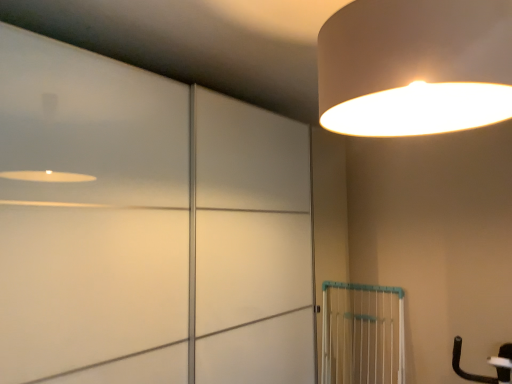
Question: Could you tell me if white plastic gate at lower right is turned towards matte white lampshade at upper right?

Choices:
 (A) no
 (B) yes

Answer: (A)

Question: Does white plastic gate at lower right have a larger size compared to matte white lampshade at upper right?

Choices:
 (A) yes
 (B) no

Answer: (B)

Question: Can you confirm if white plastic gate at lower right is smaller than matte white lampshade at upper right?

Choices:
 (A) no
 (B) yes

Answer: (B)

Question: Are white plastic gate at lower right and matte white lampshade at upper right making contact?

Choices:
 (A) yes
 (B) no

Answer: (B)

Question: Does white plastic gate at lower right appear on the right side of matte white lampshade at upper right?

Choices:
 (A) no
 (B) yes

Answer: (B)

Question: Is point pyautogui.click(x=457, y=110) positioned closer to the camera than point pyautogui.click(x=343, y=291)?

Choices:
 (A) farther
 (B) closer

Answer: (B)

Question: Is matte white lampshade at upper right inside the boundaries of white plastic gate at lower right, or outside?

Choices:
 (A) inside
 (B) outside

Answer: (B)

Question: Looking at the image, does matte white lampshade at upper right seem bigger or smaller compared to white plastic gate at lower right?

Choices:
 (A) big
 (B) small

Answer: (A)

Question: Relative to white plastic gate at lower right, is matte white lampshade at upper right in front or behind?

Choices:
 (A) behind
 (B) front

Answer: (B)

Question: Considering the positions of white matte sliding door at upper left and matte white lampshade at upper right in the image, is white matte sliding door at upper left wider or thinner than matte white lampshade at upper right?

Choices:
 (A) thin
 (B) wide

Answer: (A)

Question: Which is correct: white matte sliding door at upper left is inside matte white lampshade at upper right, or outside of it?

Choices:
 (A) inside
 (B) outside

Answer: (B)

Question: In terms of size, does white matte sliding door at upper left appear bigger or smaller than matte white lampshade at upper right?

Choices:
 (A) big
 (B) small

Answer: (A)

Question: Is white matte sliding door at upper left taller or shorter than matte white lampshade at upper right?

Choices:
 (A) short
 (B) tall

Answer: (B)

Question: Do you think white plastic gate at lower right is within matte white lampshade at upper right, or outside of it?

Choices:
 (A) outside
 (B) inside

Answer: (A)

Question: Based on their positions, is white plastic gate at lower right located to the left or right of matte white lampshade at upper right?

Choices:
 (A) left
 (B) right

Answer: (B)